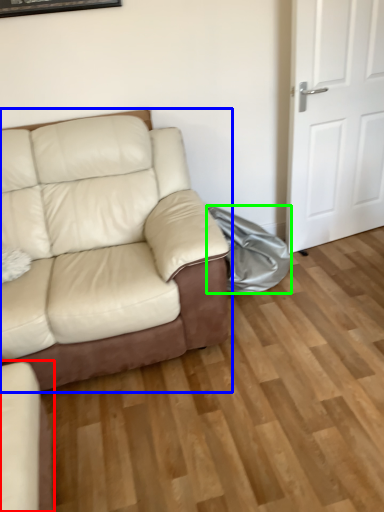
Question: Considering the real-world distances, which object is farthest from studio couch (highlighted by a red box)? studio couch (highlighted by a blue box) or material (highlighted by a green box)?

Choices:
 (A) studio couch
 (B) material

Answer: (B)